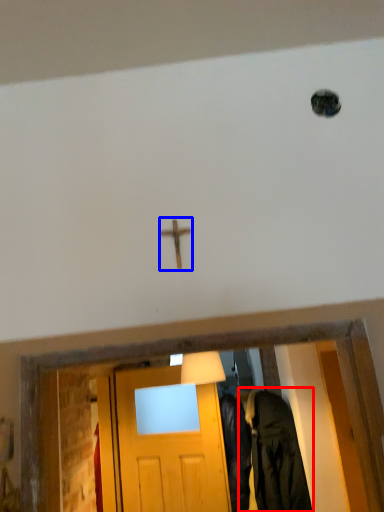
Question: Which of the following is the closest to the observer, clothing (highlighted by a red box) or crucifix (highlighted by a blue box)?

Choices:
 (A) clothing
 (B) crucifix

Answer: (B)